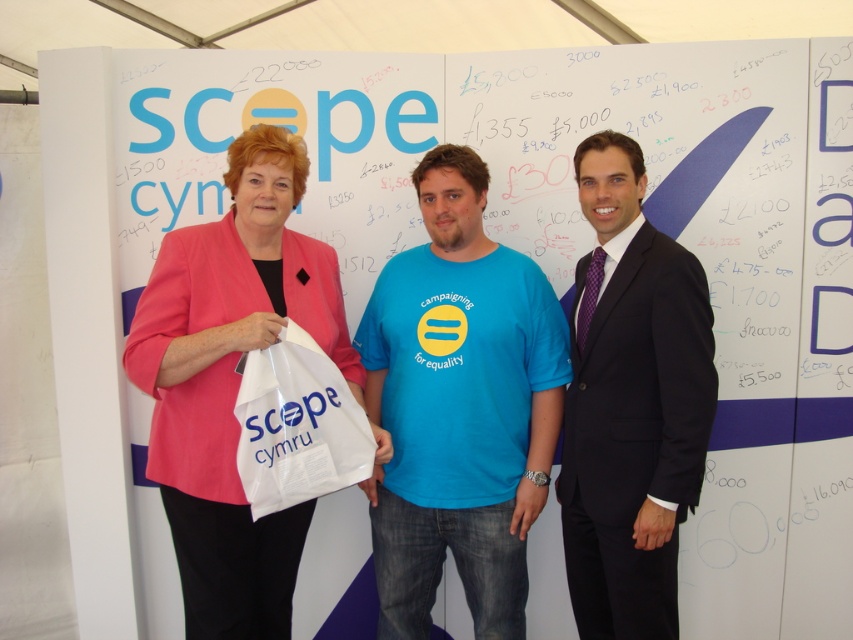
Question: Which object is positioned farthest from the black suit at center?

Choices:
 (A) white plastic bag at center
 (B) blue cotton t-shirt at center
 (C) pink fabric jacket at center

Answer: (C)

Question: Does black suit at center appear over white plastic bag at center?

Choices:
 (A) no
 (B) yes

Answer: (B)

Question: Which point is closer to the camera?

Choices:
 (A) blue cotton t-shirt at center
 (B) black suit at center
 (C) pink fabric jacket at center
 (D) white plastic bag at center

Answer: (D)

Question: Which of the following is the farthest from the observer?

Choices:
 (A) white plastic bag at center
 (B) blue cotton t-shirt at center
 (C) pink fabric jacket at center
 (D) black suit at center

Answer: (B)

Question: Where is blue cotton t-shirt at center located in relation to white plastic bag at center in the image?

Choices:
 (A) left
 (B) right

Answer: (B)

Question: Is pink fabric jacket at center bigger than black suit at center?

Choices:
 (A) yes
 (B) no

Answer: (A)